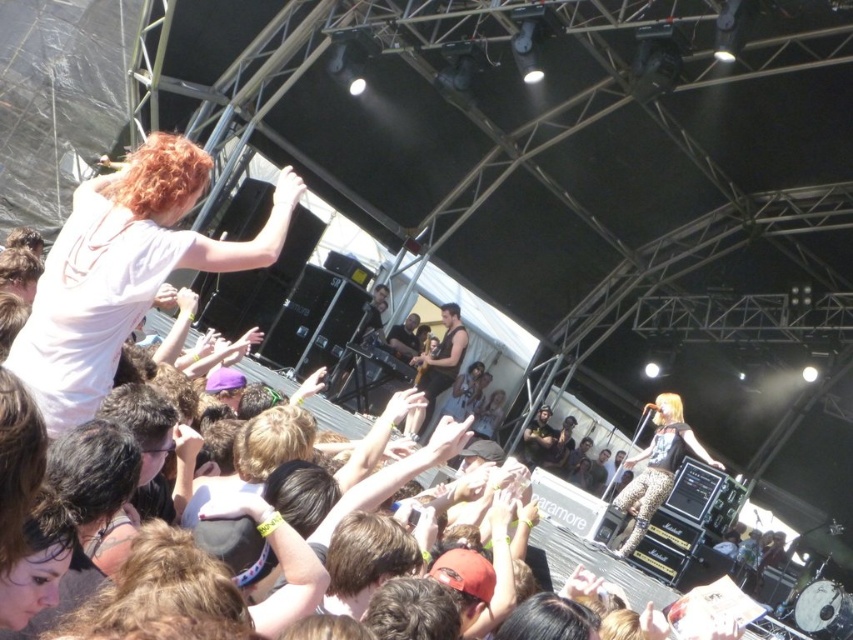
Is leopard print pants at center below matte black guitar at center?

Indeed, leopard print pants at center is positioned under matte black guitar at center.

Which of these two, leopard print pants at center or matte black guitar at center, stands taller?

leopard print pants at center is taller.

Find the location of a particular element. leopard print pants at center is located at coordinates (657, 467).

Which is in front, point (155, 241) or point (643, 468)?

Point (155, 241) is in front.

What do you see at coordinates (125, 269) in the screenshot? The image size is (853, 640). I see `matte white t-shirt at upper left` at bounding box center [125, 269].

This screenshot has width=853, height=640. I want to click on matte white t-shirt at upper left, so click(x=125, y=269).

Who is higher up, matte white t-shirt at upper left or matte black guitar at center?

matte white t-shirt at upper left is above.

Between point (78, 326) and point (415, 317), which one is positioned behind?

Positioned behind is point (415, 317).

Locate an element on the screen. This screenshot has height=640, width=853. matte white t-shirt at upper left is located at coordinates (125, 269).